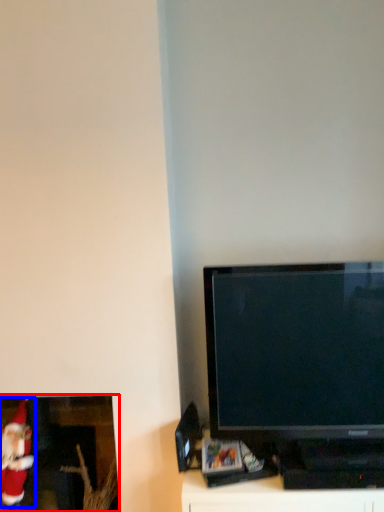
Question: Which object is further to the camera taking this photo, picture frame (highlighted by a red box) or santa claus (highlighted by a blue box)?

Choices:
 (A) picture frame
 (B) santa claus

Answer: (A)